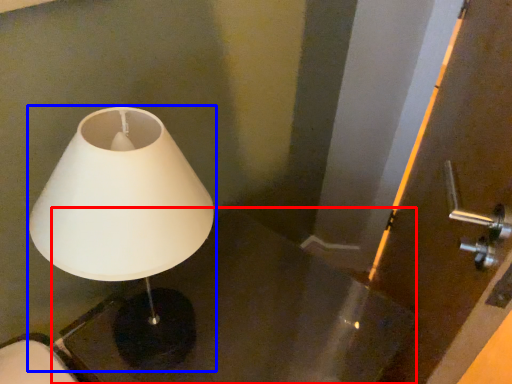
Question: Among these objects, which one is nearest to the camera, table (highlighted by a red box) or lamp (highlighted by a blue box)?

Choices:
 (A) table
 (B) lamp

Answer: (B)